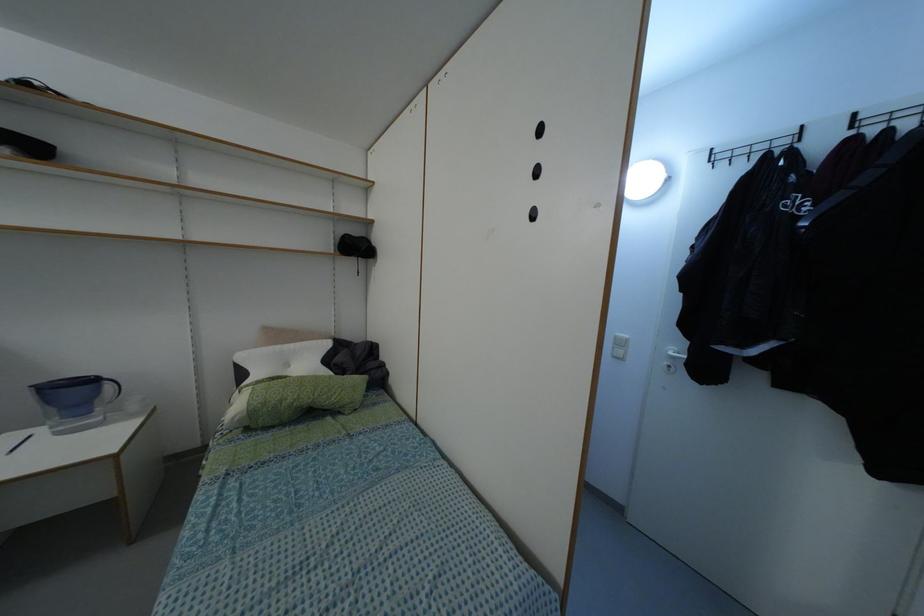
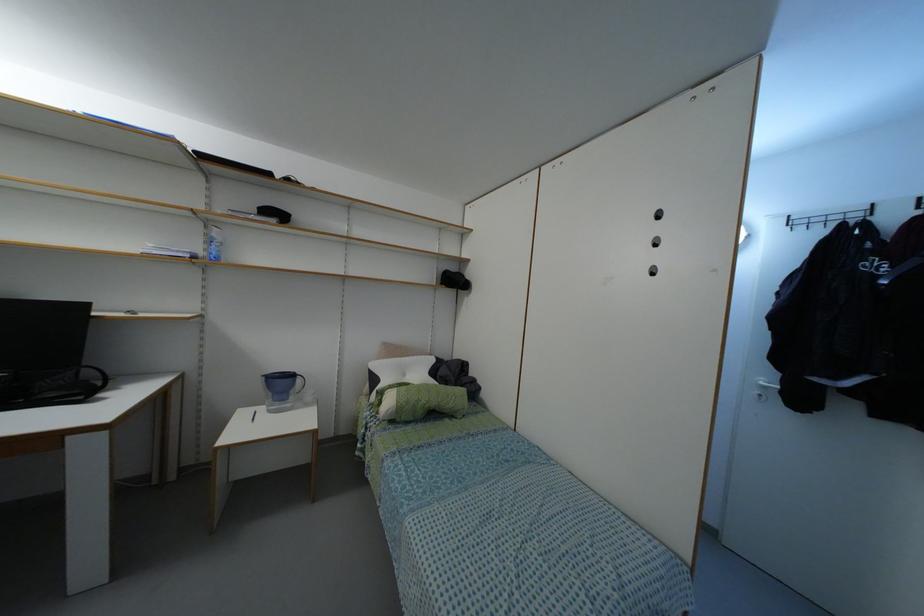
Where in the second image is the point corresponding to point (673, 357) from the first image?

(763, 387)